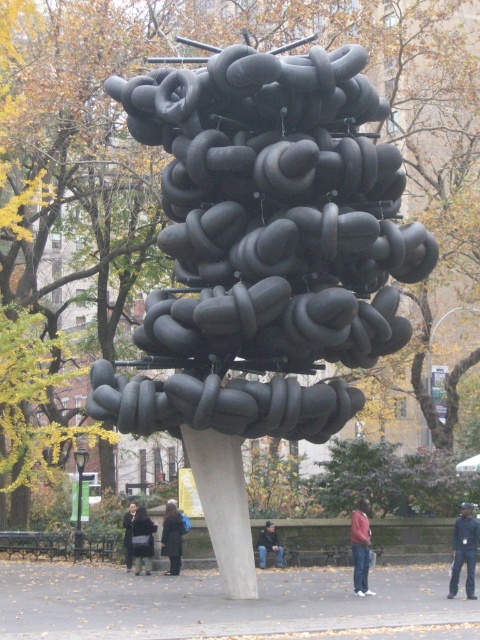
You are standing in the park and want to take a photo of the sculpture. The point at coordinate (178, 548) is part of the sculpture. If your camera has a maximum focus range of 100 feet, will you be able to focus on that point?

The point at coordinate (178, 548) is 102.45 feet away from the viewer, which exceeds the camera maximum focus range of 100 feet. Therefore, the camera will not be able to focus on that point.

You are standing in the park looking at the art installation. You notice a point at coordinates (464, 550). What object is located at this point?

The point at coordinates (464, 550) corresponds to dark blue jeans at lower right.